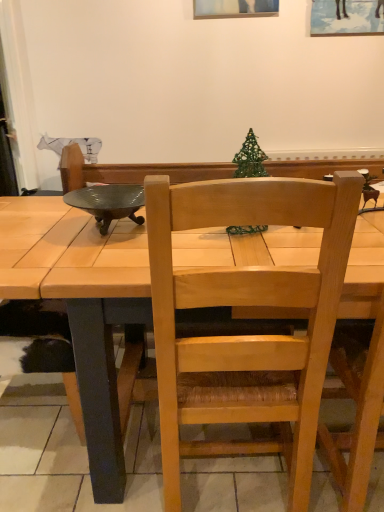
Where is `vacant space in front of metallic green bowl at upper left`? vacant space in front of metallic green bowl at upper left is located at coordinates (79, 256).